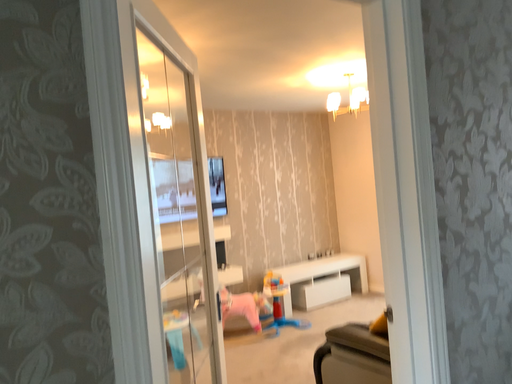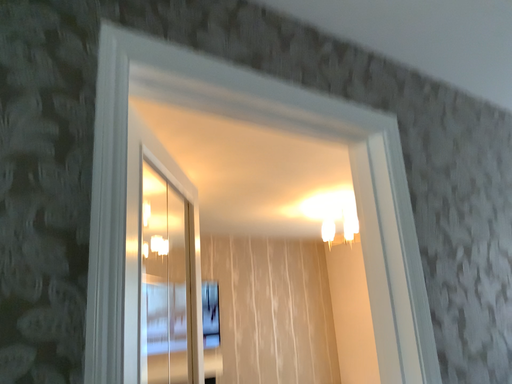
Question: How did the camera likely rotate when shooting the video?

Choices:
 (A) rotated upward
 (B) rotated downward

Answer: (A)